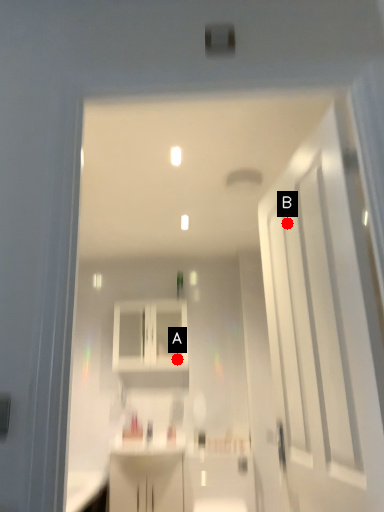
Question: Two points are circled on the image, labeled by A and B beside each circle. Which point appears farthest from the camera in this image?

Choices:
 (A) A is further
 (B) B is further

Answer: (A)